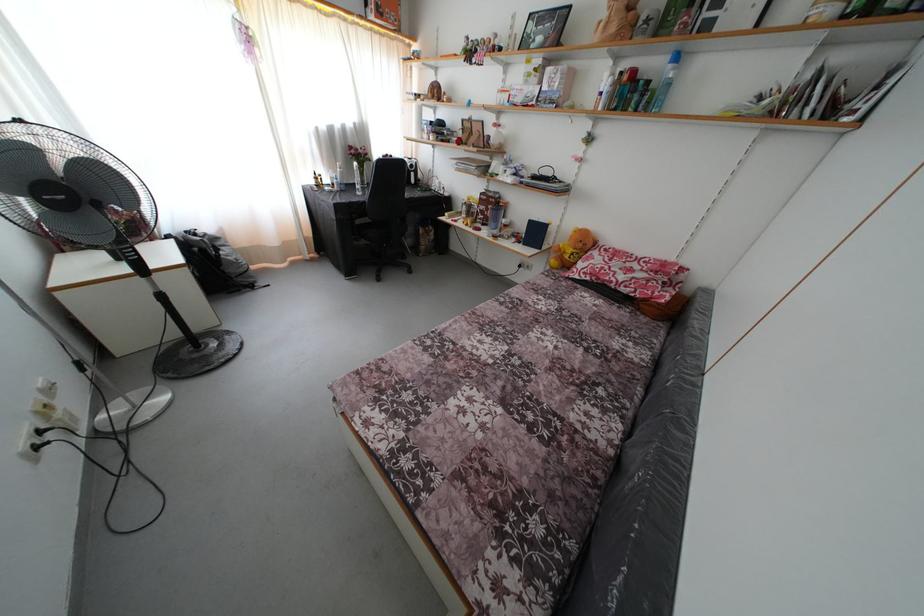
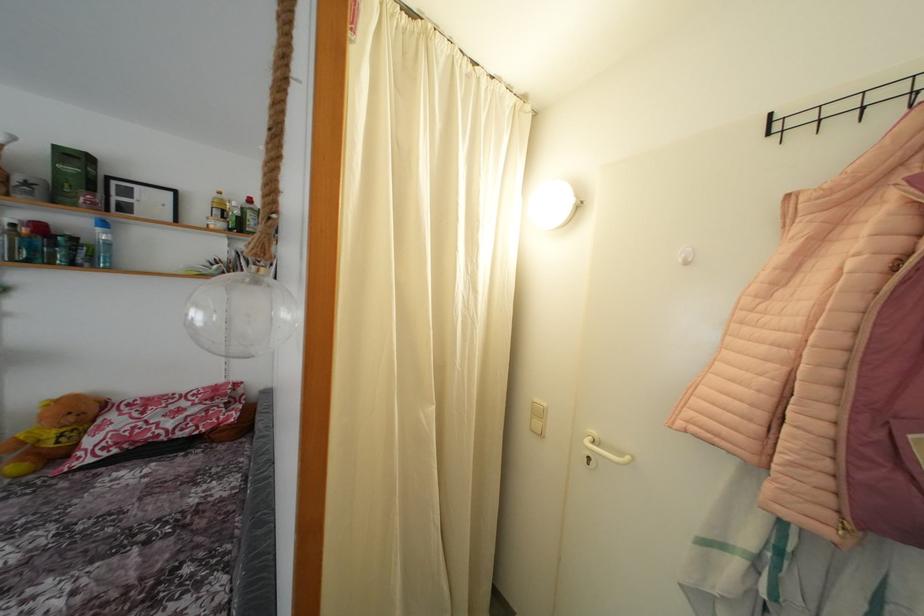
Locate, in the second image, the point that corresponds to the point at 675,73 in the first image.

(104, 236)